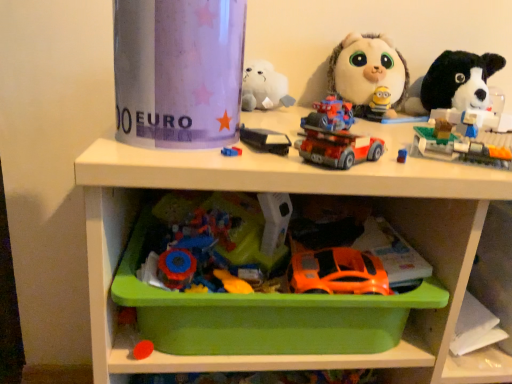
Locate an element on the screen. This screenshot has width=512, height=384. free space that is in between fluffy white plush toy at upper right, positioned as the 1th toy in top-to-bottom order, and translucent plastic building blocks at upper right, which is the third toy from top to bottom is located at coordinates (397, 129).